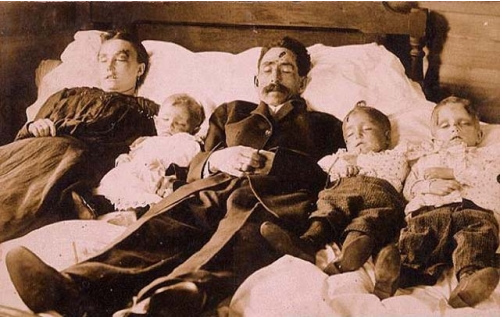
At what (x,y) coordinates should I click in order to perform the action: click on bed head. Please return your answer as a coordinate pair (x, y). Image resolution: width=502 pixels, height=320 pixels. Looking at the image, I should click on (289, 13).